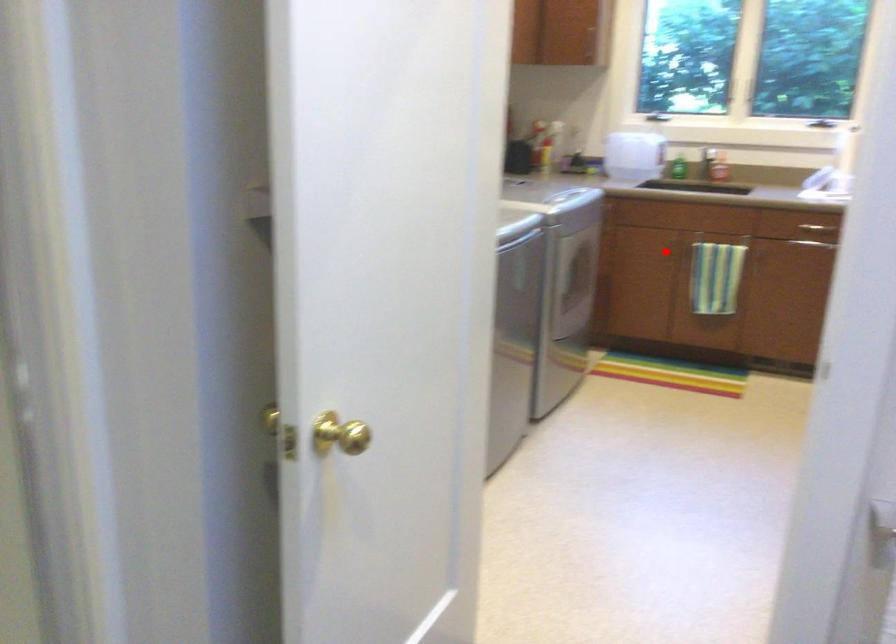
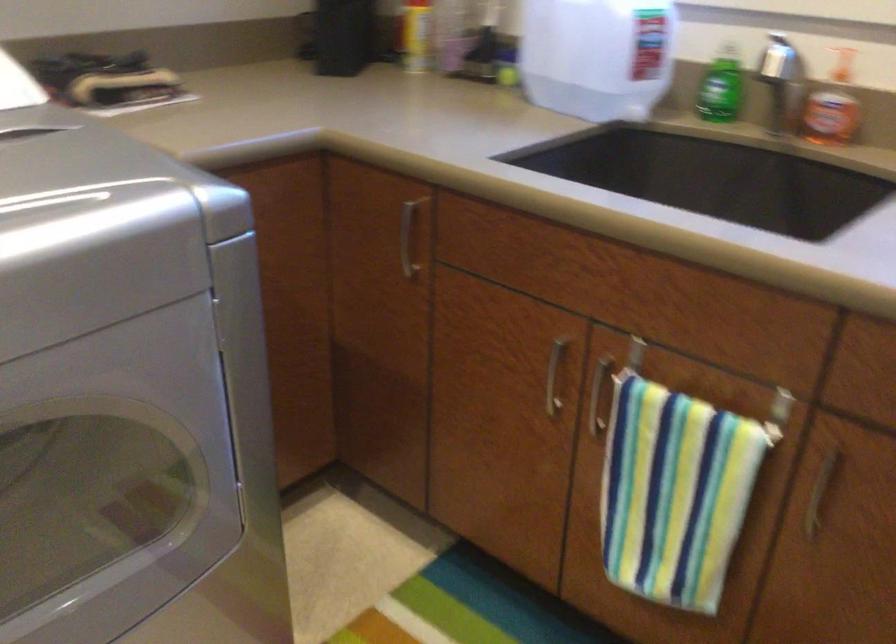
Question: I am providing you with two images of the same scene from different viewpoints. Image1 has a red point marked. In image2, the corresponding 3D location appears at what relative position? Reply with the corresponding letter.

Choices:
 (A) Closer
 (B) Farther

Answer: (A)